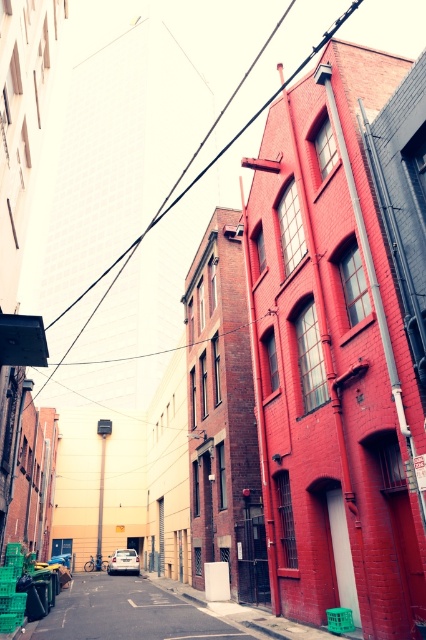
Question: Which point is closer to the camera?

Choices:
 (A) click(37, 394)
 (B) click(149, 628)
 (C) click(98, 545)
 (D) click(132, 548)

Answer: (B)

Question: Which point is closer to the camera?

Choices:
 (A) metallic rectangular sign at center
 (B) matte black car at center
 (C) white matte car at center

Answer: (B)

Question: Does metallic rectangular sign at center come behind white matte car at center?

Choices:
 (A) no
 (B) yes

Answer: (B)

Question: Can you confirm if metallic rectangular sign at center is positioned below white matte car at center?

Choices:
 (A) yes
 (B) no

Answer: (B)

Question: Which object appears farthest from the camera in this image?

Choices:
 (A) white matte car at center
 (B) black wire at upper center

Answer: (A)

Question: Can you confirm if black wire at upper center is thinner than metallic rectangular sign at center?

Choices:
 (A) no
 (B) yes

Answer: (A)